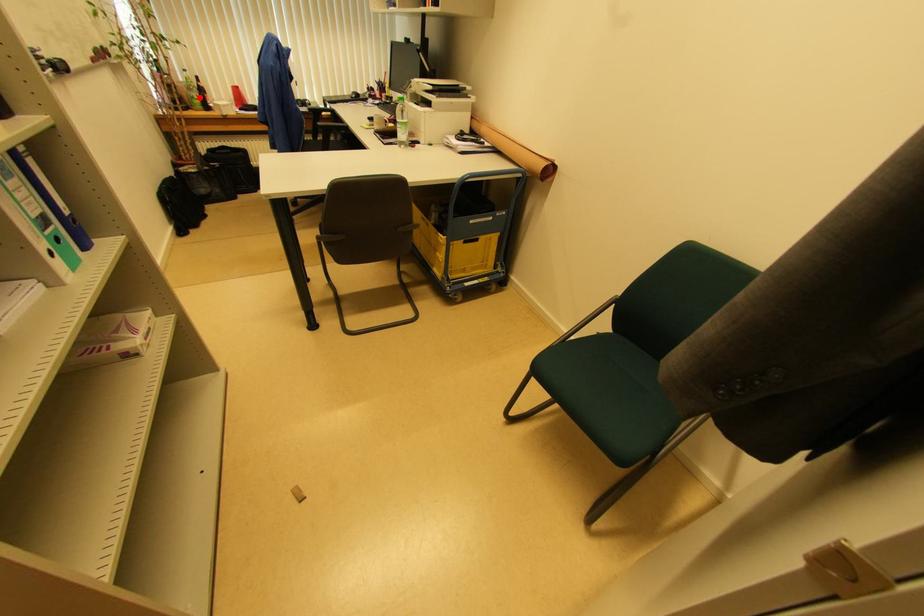
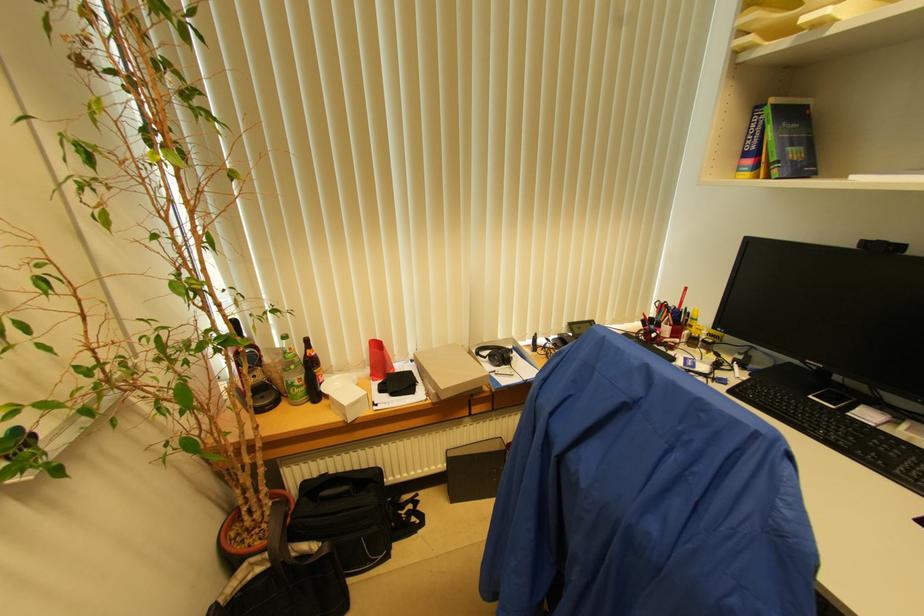
Question: A red point is marked in image1. In image2, is the corresponding 3D point closer to the camera or farther? Reply with the corresponding letter.

Choices:
 (A) The corresponding 3D point is closer.
 (B) The corresponding 3D point is farther.

Answer: (A)